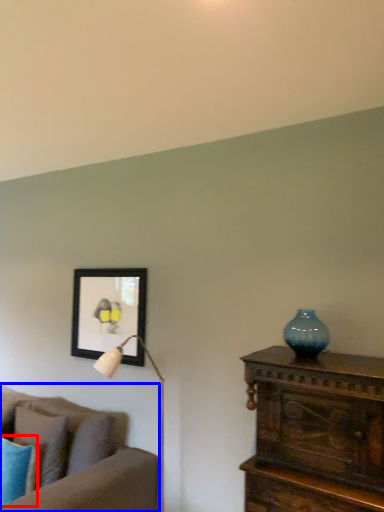
Question: Which of the following is the farthest to the observer, pillow (highlighted by a red box) or studio couch (highlighted by a blue box)?

Choices:
 (A) pillow
 (B) studio couch

Answer: (A)